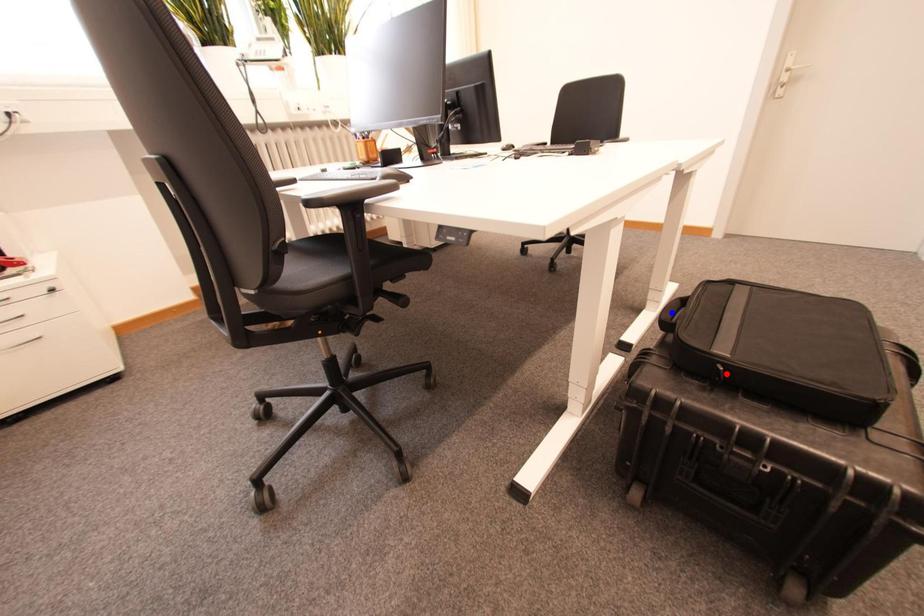
Question: Two points are marked on the image. Which point is closer to the camera?

Choices:
 (A) Blue point is closer.
 (B) Red point is closer.

Answer: (B)